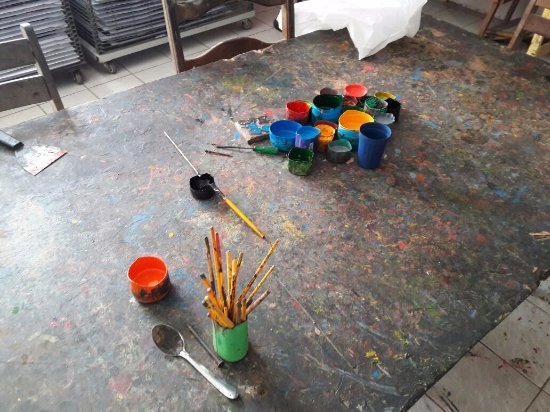
Image resolution: width=550 pixels, height=412 pixels. Find the location of `paint drying rack`. paint drying rack is located at coordinates (128, 20).